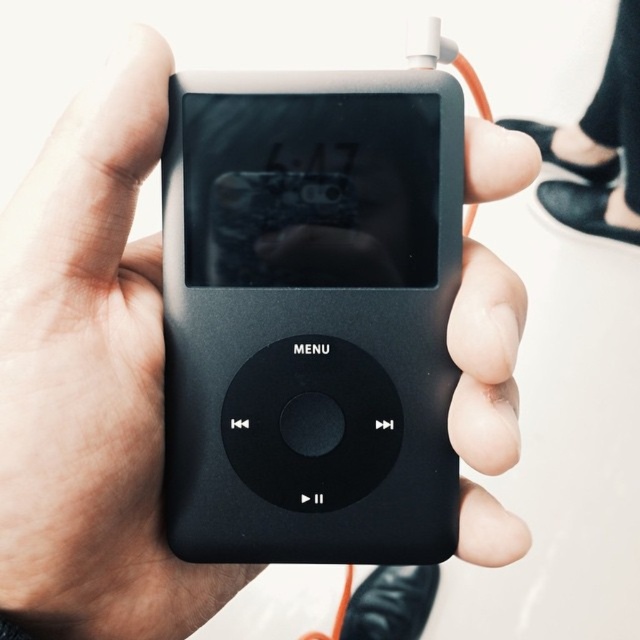
Question: Which point is farther from the camera taking this photo?

Choices:
 (A) (545, 154)
 (B) (211, 259)

Answer: (A)

Question: Which point is closer to the camera?

Choices:
 (A) (632, 1)
 (B) (368, 513)

Answer: (B)

Question: In this image, where is black matte/ipod at center located relative to black leather shoe at lower right?

Choices:
 (A) below
 (B) above

Answer: (A)

Question: Does black matte/ipod at center have a greater width compared to black leather shoe at lower right?

Choices:
 (A) yes
 (B) no

Answer: (B)

Question: From the image, what is the correct spatial relationship of black matte/ipod at center in relation to black leather shoe at lower right?

Choices:
 (A) left
 (B) right

Answer: (A)